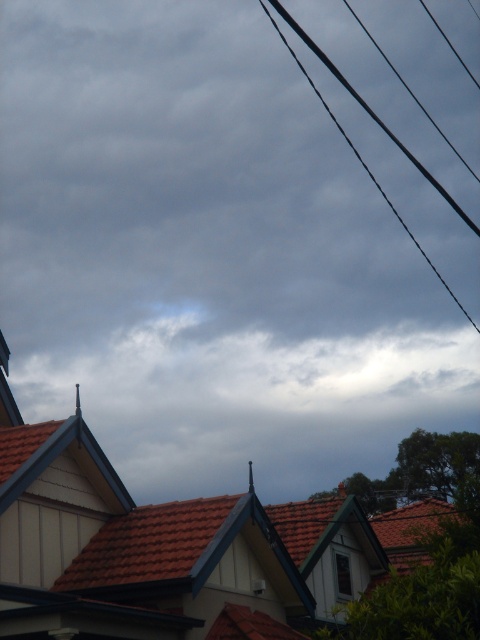
Question: Can you confirm if brown tile roof at center is positioned above black wire at upper right?

Choices:
 (A) no
 (B) yes

Answer: (A)

Question: Does brown tile roof at center appear on the right side of black wire at upper right?

Choices:
 (A) yes
 (B) no

Answer: (B)

Question: Which point is farther from the camera taking this photo?

Choices:
 (A) pyautogui.click(x=8, y=515)
 (B) pyautogui.click(x=300, y=61)

Answer: (B)

Question: Can you confirm if brown tile roof at center is wider than black wire at upper right?

Choices:
 (A) yes
 (B) no

Answer: (B)

Question: Among these objects, which one is farthest from the camera?

Choices:
 (A) black wire at upper right
 (B) brown tile roof at center

Answer: (A)